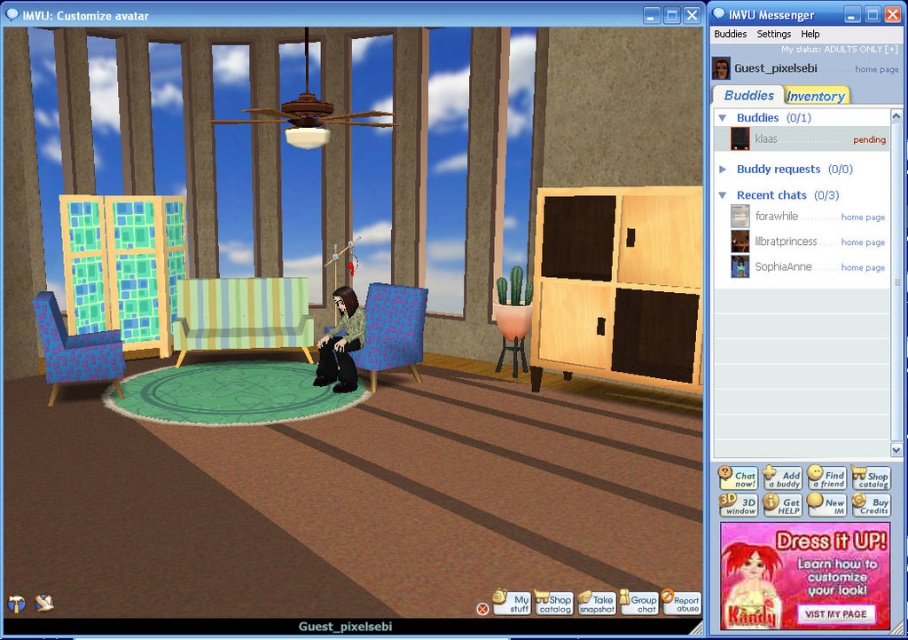
Is blue pixelated armchair at left smaller than green fuzzy sweater at center?

Actually, blue pixelated armchair at left might be larger than green fuzzy sweater at center.

Which is behind, point (53, 348) or point (327, 376)?

The point (327, 376) is behind.

Which is behind, point (75, 369) or point (353, 336)?

The point (353, 336) is more distant.

At what (x,y) coordinates should I click in order to perform the action: click on blue pixelated armchair at left. Please return your answer as a coordinate pair (x, y). The height and width of the screenshot is (640, 908). Looking at the image, I should click on (75, 349).

Which is below, matte blue fabric armchair at center or green fuzzy sweater at center?

matte blue fabric armchair at center is lower down.

Between matte blue fabric armchair at center and green fuzzy sweater at center, which one is positioned higher?

Positioned higher is green fuzzy sweater at center.

At what (x,y) coordinates should I click in order to perform the action: click on matte blue fabric armchair at center. Please return your answer as a coordinate pair (x, y). Looking at the image, I should click on (391, 330).

Which is more to the right, green striped fabric armchair at center or blue pixelated armchair at left?

Positioned to the right is green striped fabric armchair at center.

Can you confirm if green striped fabric armchair at center is positioned above blue pixelated armchair at left?

Correct, green striped fabric armchair at center is located above blue pixelated armchair at left.

Locate an element on the screen. green striped fabric armchair at center is located at coordinates (242, 314).

Where is `green striped fabric armchair at center`? The width and height of the screenshot is (908, 640). green striped fabric armchair at center is located at coordinates (242, 314).